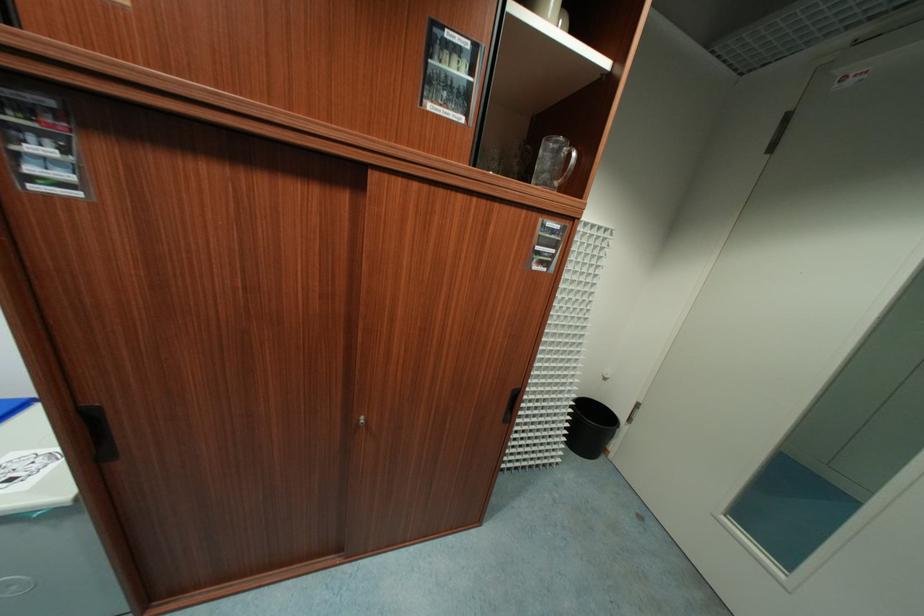
The image size is (924, 616). What do you see at coordinates (361, 422) in the screenshot?
I see `the cabinet keyhole` at bounding box center [361, 422].